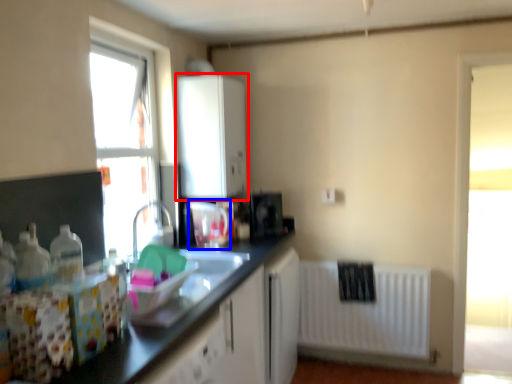
Question: Which object appears farthest to the camera in this image, cabinetry (highlighted by a red box) or appliance (highlighted by a blue box)?

Choices:
 (A) cabinetry
 (B) appliance

Answer: (A)